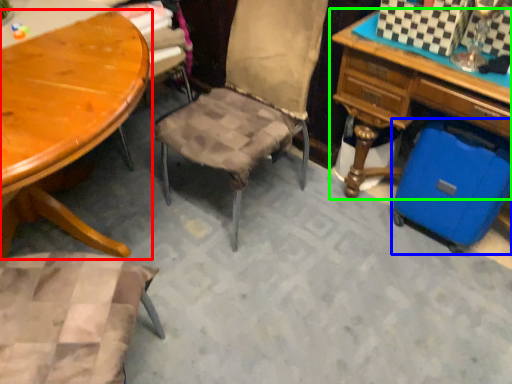
Question: Which object is positioned farthest from table (highlighted by a red box)? Select from luggage (highlighted by a blue box) and desk (highlighted by a green box).

Choices:
 (A) luggage
 (B) desk

Answer: (A)